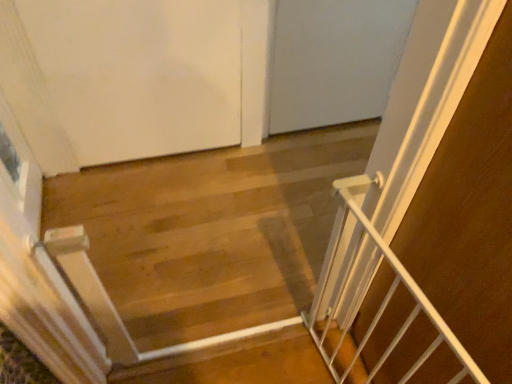
The height and width of the screenshot is (384, 512). Identify the location of vacant location below white matte door at upper left (from a real-world perspective). (162, 152).